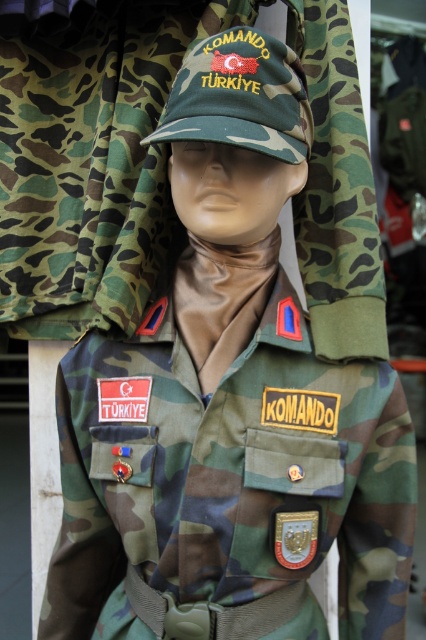
You are a tailor trying to determine the correct placement for a new patch on the mannequin. Given the positions of the camo fabric jacket at upper center and the camouflage fabric cap at center, which item is taller?

The camo fabric jacket at upper center is taller than the camouflage fabric cap at center.

You are a tailor who needs to determine which item, the camo fabric jacket at upper center or the camouflage fabric cap at center, requires more fabric to produce. Based on the image, which one would need more fabric?

The camo fabric jacket at upper center requires more fabric to produce since it has a larger size compared to the camouflage fabric cap at center.

You are an observer looking at the mannequin. Which object is closer to you between the camo fabric jacket at upper center and the camouflage fabric cap at center?

The camo fabric jacket at upper center is closer to you because it is further to the viewer than the camouflage fabric cap at center.